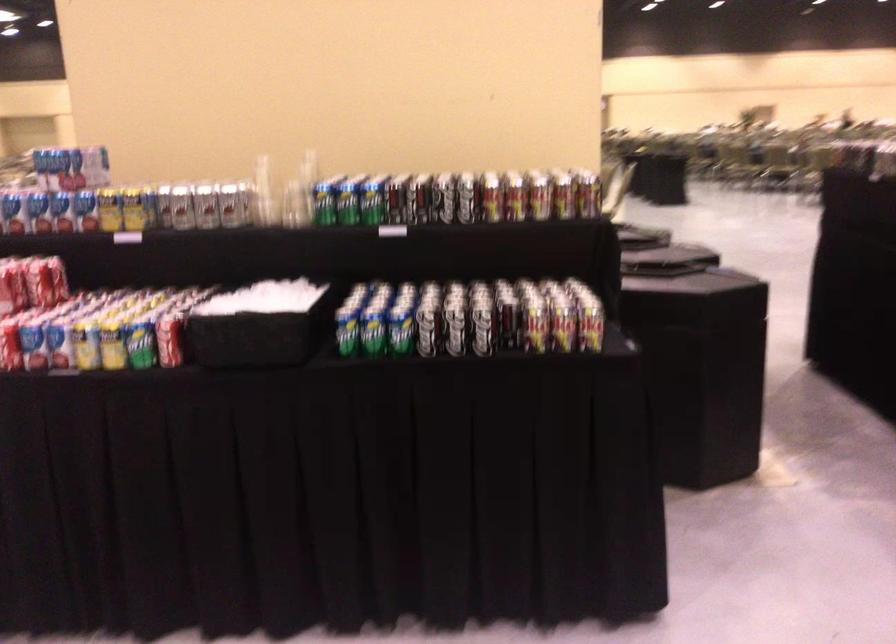
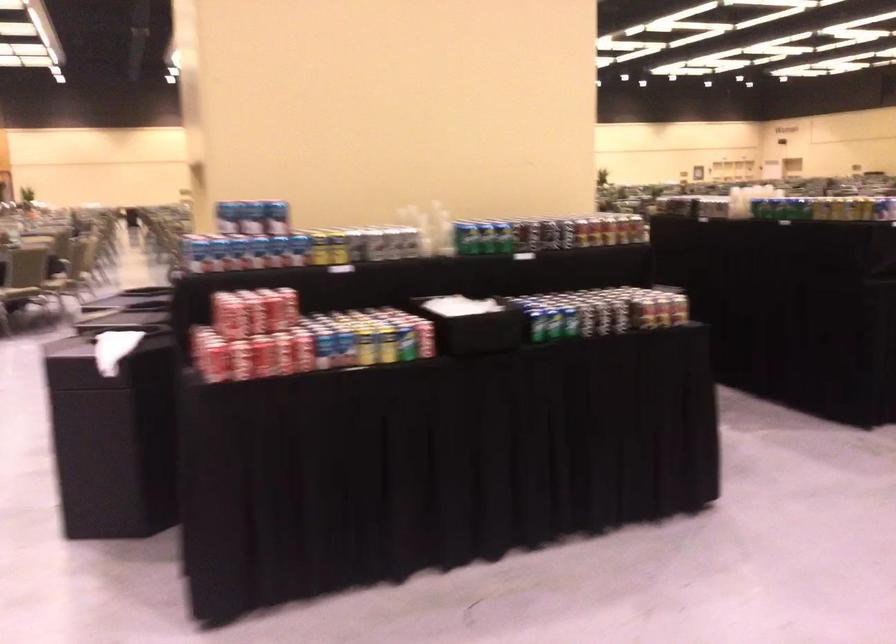
Where in the second image is the point corresponding to point 366,204 from the first image?

(504, 237)